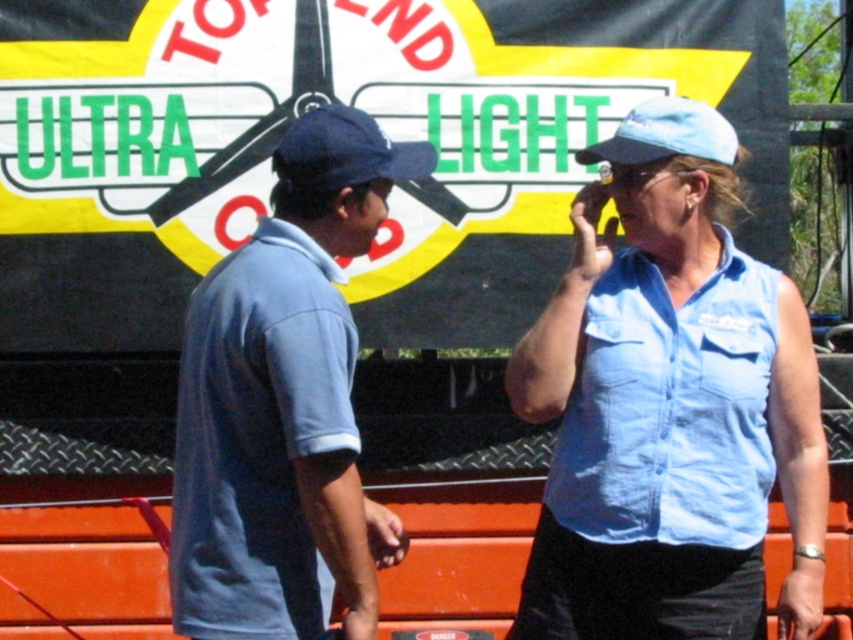
Question: Is light blue denim shirt at center smaller than matte blue polo shirt at left?

Choices:
 (A) no
 (B) yes

Answer: (B)

Question: Can you confirm if light blue denim shirt at center is bigger than navy blue fabric baseball cap at upper center?

Choices:
 (A) yes
 (B) no

Answer: (A)

Question: Which of the following is the closest to the observer?

Choices:
 (A) (611, 458)
 (B) (276, 236)

Answer: (B)

Question: Is matte blue polo shirt at left to the left of navy blue fabric baseball cap at upper center from the viewer's perspective?

Choices:
 (A) no
 (B) yes

Answer: (B)

Question: Among these objects, which one is farthest from the camera?

Choices:
 (A) light blue button-up shirt at right
 (B) blue fabric baseball cap at upper right

Answer: (B)

Question: Among these objects, which one is farthest from the camera?

Choices:
 (A) light blue denim shirt at center
 (B) blue fabric baseball cap at upper right

Answer: (B)